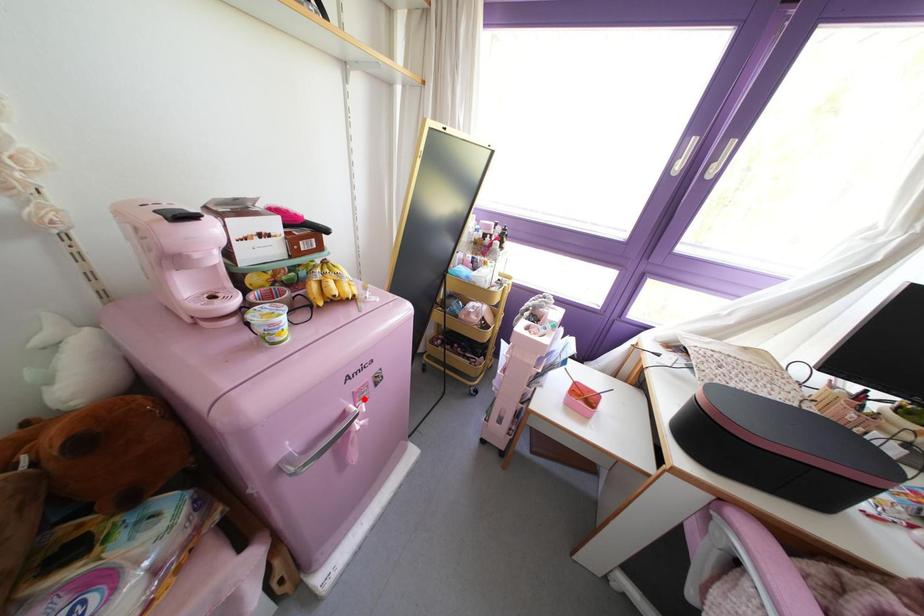
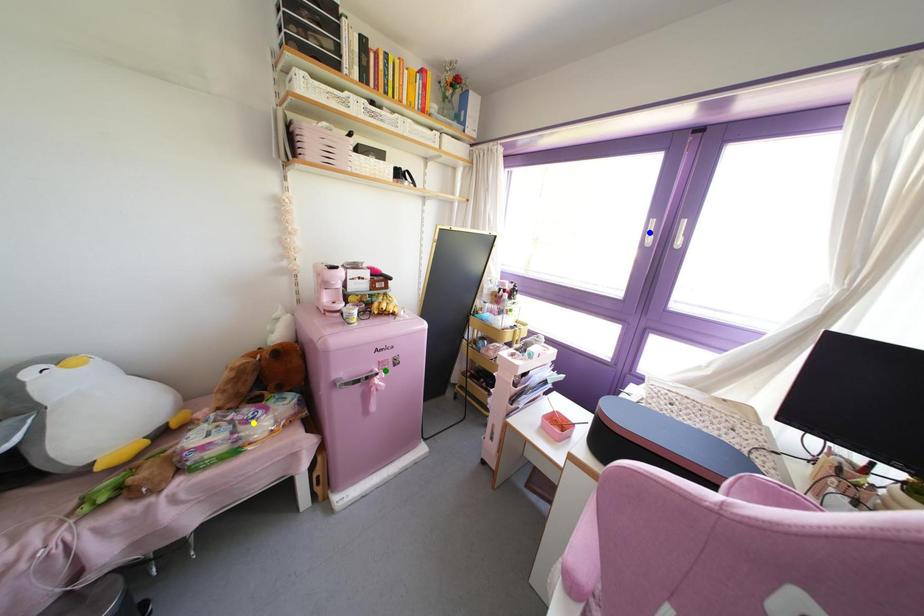
Question: I am providing you with two images of the same scene from different viewpoints. A red point is marked on the first image. You are given multiple points on the second image. Which point in image 2 represents the same 3d spot as the red point in image 1?

Choices:
 (A) yellow point
 (B) blue point
 (C) green point

Answer: (C)